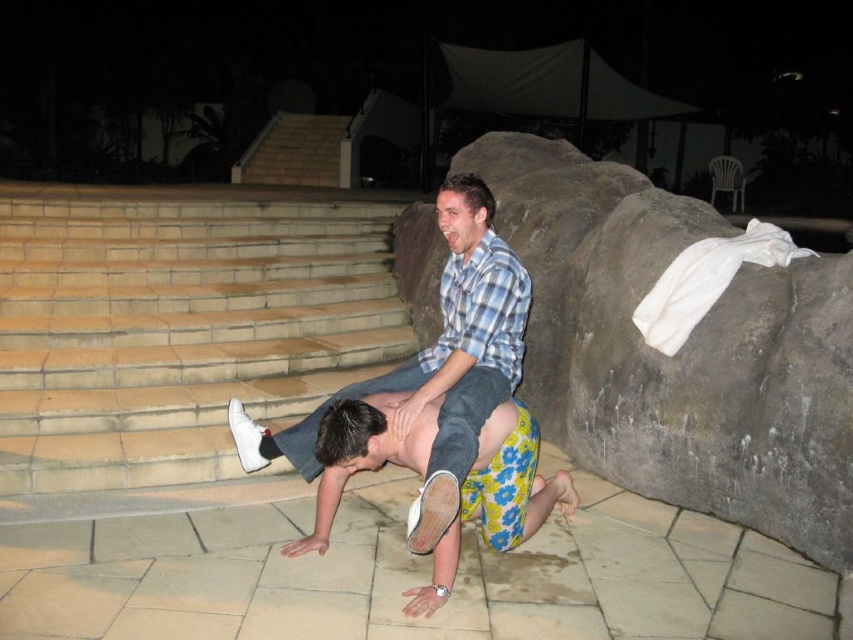
Question: Which object is positioned farthest from the floral shorts at center?

Choices:
 (A) blue plaid shirt at center
 (B) light brown stone stairs at lower left

Answer: (B)

Question: Among these objects, which one is nearest to the camera?

Choices:
 (A) floral shorts at center
 (B) light brown stone stairs at lower left

Answer: (A)

Question: Does light brown stone stairs at lower left have a larger size compared to blue plaid shirt at center?

Choices:
 (A) yes
 (B) no

Answer: (A)

Question: Which point is farther from the camera taking this photo?

Choices:
 (A) (345, 205)
 (B) (434, 525)
 (C) (509, 513)

Answer: (A)

Question: From the image, what is the correct spatial relationship of light brown stone stairs at lower left in relation to floral shorts at center?

Choices:
 (A) below
 (B) above

Answer: (B)

Question: Can you confirm if blue plaid shirt at center is bigger than floral shorts at center?

Choices:
 (A) no
 (B) yes

Answer: (B)